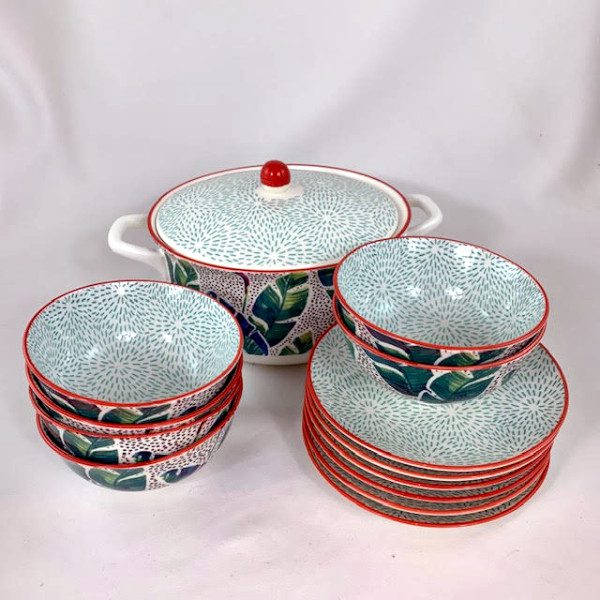
Locate an element on the screen. decorative bowl is located at coordinates (171, 406), (157, 427), (159, 434), (167, 463), (433, 344), (428, 372).